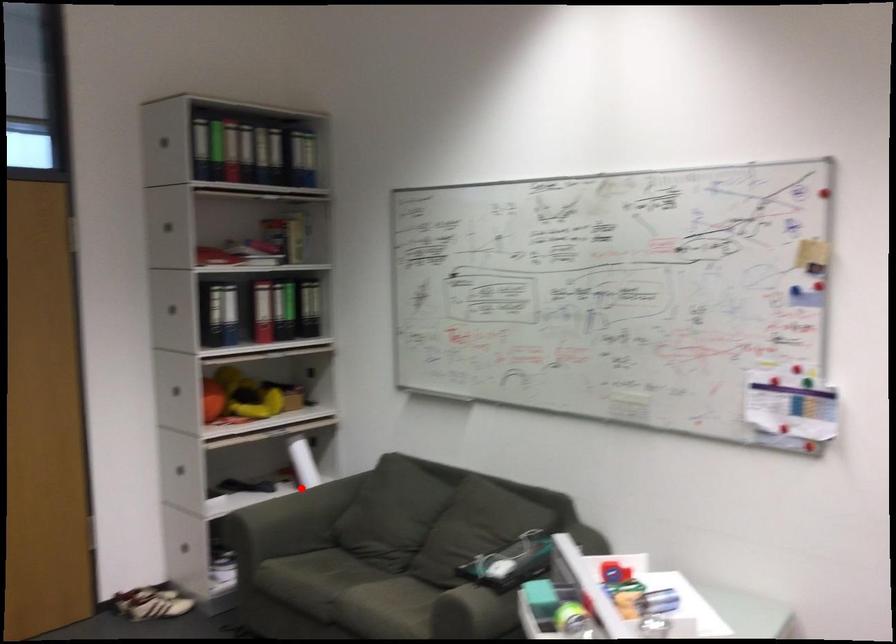
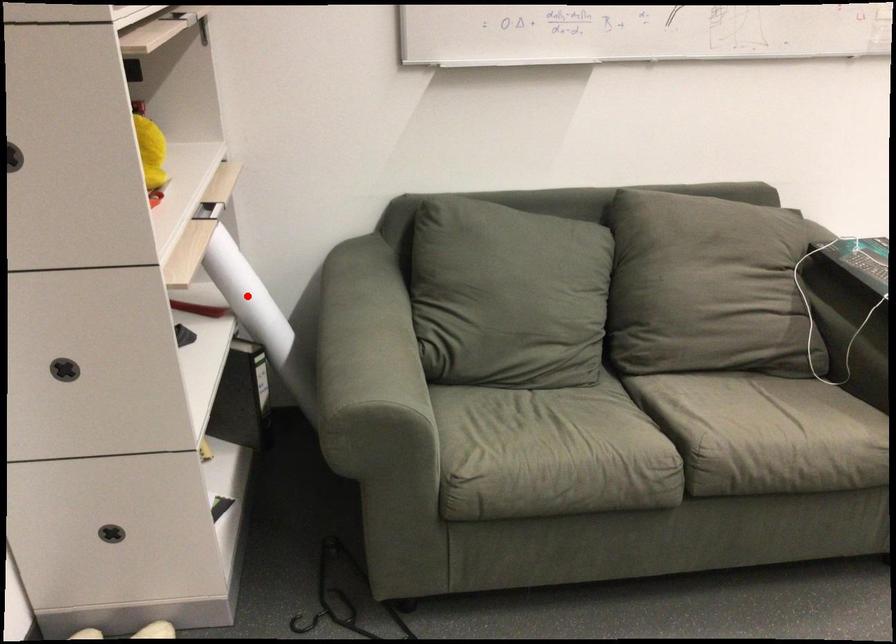
I am providing you with two images of the same scene from different viewpoints. A red point is marked on the first image and another point is marked on the second image. Do the highlighted points in image1 and image2 indicate the same real-world spot?

Yes